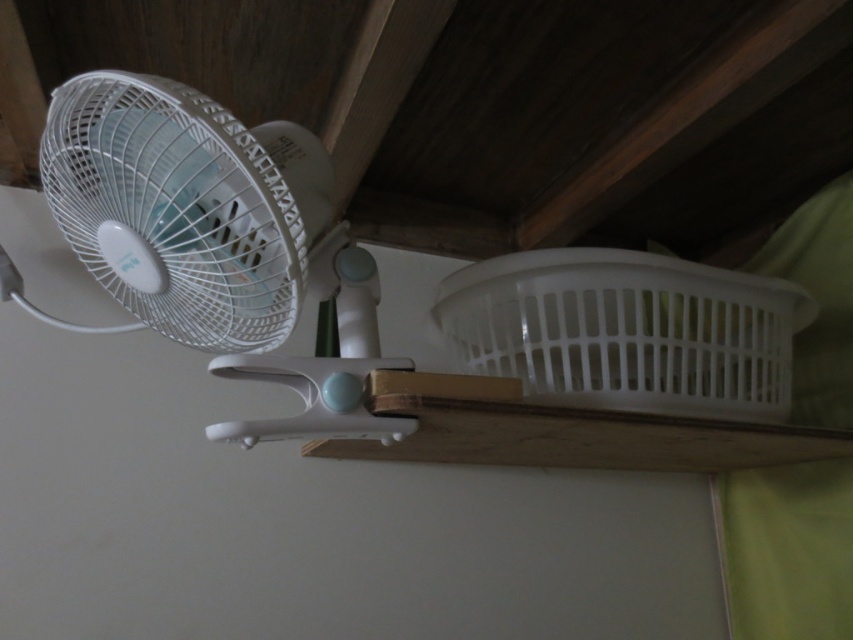
Question: Can you confirm if white plastic fan at left is wider than white plastic basket at upper center?

Choices:
 (A) no
 (B) yes

Answer: (A)

Question: Does white plastic fan at left appear on the right side of white plastic basket at upper center?

Choices:
 (A) no
 (B) yes

Answer: (A)

Question: Which of the following is the closest to the observer?

Choices:
 (A) white plastic fan at left
 (B) white plastic basket at upper center

Answer: (A)

Question: Can you confirm if white plastic fan at left is positioned to the left of white plastic basket at upper center?

Choices:
 (A) no
 (B) yes

Answer: (B)